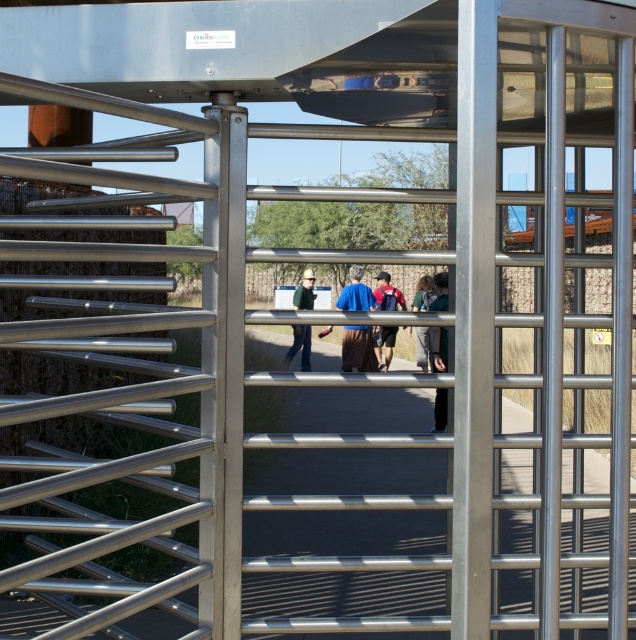
You are standing at the camera position and want to reach the point marked at coordinates (270, 522). Can you estimate how far you need to walk to get there?

The point marked at coordinates (270, 522) is 8.72 meters away from the camera, so you need to walk approximately 8.72 meters to reach it.

You are a pedestrian standing at the turnstile gate and see both the brown fabric at center and the dark gray fabric jacket at center. Which one is nearer to you?

The brown fabric at center is closer to the viewer than the dark gray fabric jacket at center.

You are a pedestrian approaching the turnstile gate. You see two points marked on the path ahead of you. The first point is at coordinate point (x=366, y=324) and the second is at point (x=425, y=298). Which point is closer to you as you approach the turnstile?

Point (x=366, y=324) is in front of point (x=425, y=298), so it is closer to you as you approach the turnstile.